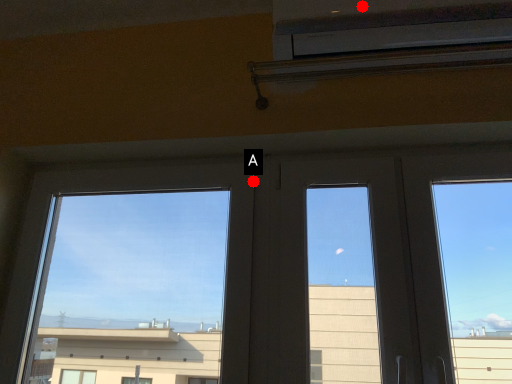
Question: Two points are circled on the image, labeled by A and B beside each circle. Which point is further to the camera?

Choices:
 (A) A is further
 (B) B is further

Answer: (A)